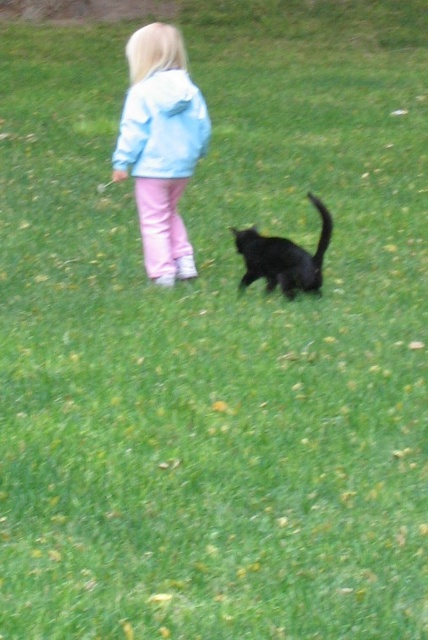
Can you confirm if light blue fleece jacket at upper left is positioned above shiny black cat at center?

Yes, light blue fleece jacket at upper left is above shiny black cat at center.

Is light blue fleece jacket at upper left thinner than shiny black cat at center?

No, light blue fleece jacket at upper left is not thinner than shiny black cat at center.

Identify the location of light blue fleece jacket at upper left. Image resolution: width=428 pixels, height=640 pixels. (160, 145).

I want to click on light blue fleece jacket at upper left, so click(160, 145).

From the picture: Is light blue fleece jacket at upper center further to the viewer compared to shiny black cat at center?

Yes, it is behind shiny black cat at center.

Can you confirm if light blue fleece jacket at upper center is shorter than shiny black cat at center?

Incorrect, light blue fleece jacket at upper center's height does not fall short of shiny black cat at center's.

Is point (199, 104) positioned in front of point (267, 275)?

No, it is not.

Where is `light blue fleece jacket at upper center`? The image size is (428, 640). light blue fleece jacket at upper center is located at coordinates (162, 125).

Is light blue fleece jacket at upper left bigger than light blue fleece jacket at upper center?

Indeed, light blue fleece jacket at upper left has a larger size compared to light blue fleece jacket at upper center.

Which is more to the right, light blue fleece jacket at upper left or light blue fleece jacket at upper center?

From the viewer's perspective, light blue fleece jacket at upper center appears more on the right side.

Who is more forward, (x=193, y=259) or (x=199, y=115)?

Point (x=199, y=115) is more forward.

Locate an element on the screen. light blue fleece jacket at upper left is located at coordinates (160, 145).